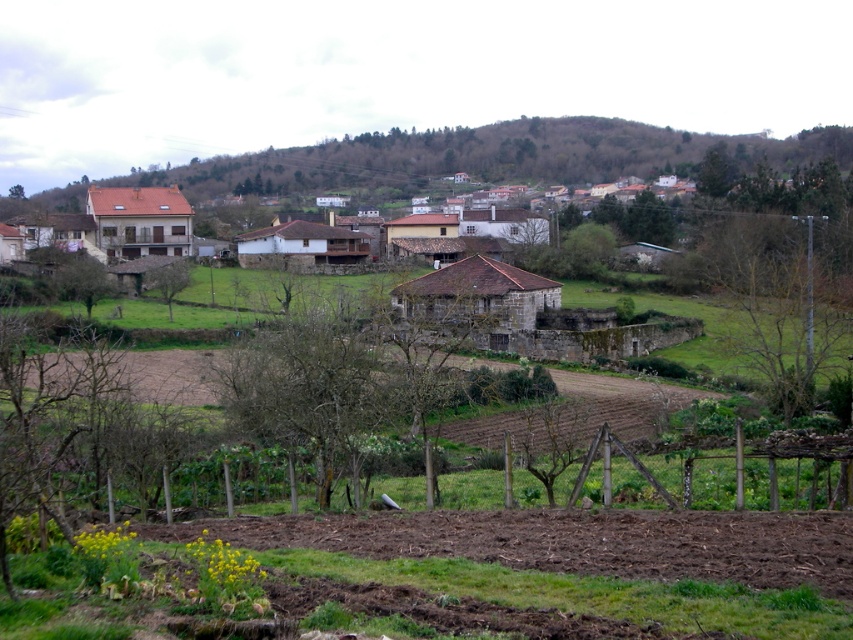
You are standing in the rural landscape depicted in the image. You want to visit the brown stone house at center. If your walking speed is 3 feet per second, how many seconds will it take you to reach the house?

The brown stone house at center is 77.60 feet away from the viewer. At a walking speed of 3 feet per second, it would take approximately 25.87 seconds to reach the house.

You are standing in the rural landscape and want to take a photo of the green leafy tree at right. If your camera can focus on objects up to 50 meters away, will you be able to capture a clear image of the tree?

The green leafy tree at right is 48.51 meters from viewer, so yes, the camera can focus on it clearly since the distance is within the 50 meters range.